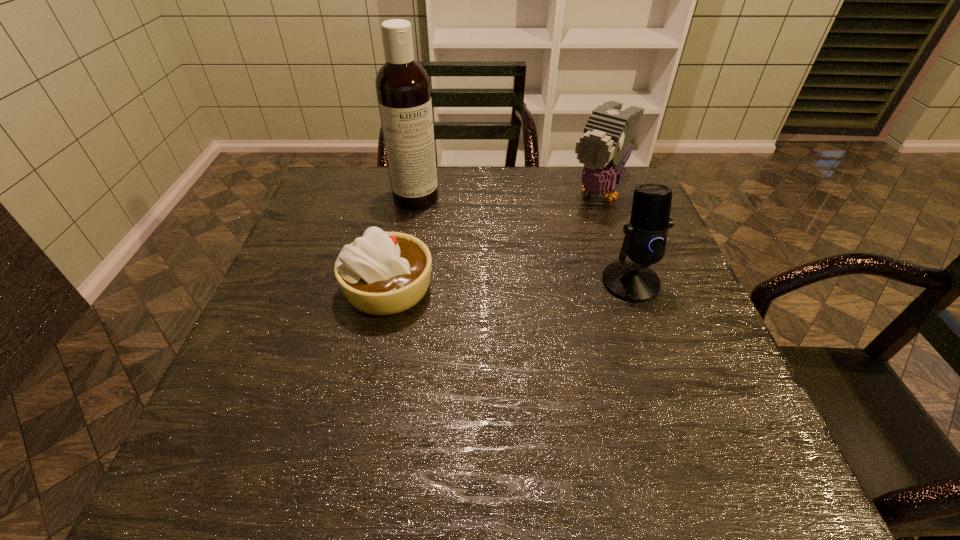
This screenshot has width=960, height=540. What are the coordinates of `vacant space situated on the label side of the tallest object` in the screenshot? It's located at (465, 259).

Locate an element on the screen. This screenshot has width=960, height=540. vacant space located 0.340m on the label side of the tallest object is located at coordinates (484, 285).

What are the coordinates of `bird that is at the far edge` in the screenshot? It's located at (604, 148).

Where is `dishwasher detergent that is at the far edge`? dishwasher detergent that is at the far edge is located at coordinates pyautogui.click(x=402, y=85).

Where is `microphone that is at the right edge`? The image size is (960, 540). microphone that is at the right edge is located at coordinates (645, 239).

Locate an element on the screen. This screenshot has height=540, width=960. bird that is at the right edge is located at coordinates (604, 148).

Locate an element on the screen. The height and width of the screenshot is (540, 960). object present at the far right corner is located at coordinates (604, 148).

This screenshot has width=960, height=540. Identify the location of vacant area at the far edge. (510, 208).

This screenshot has width=960, height=540. I want to click on vacant region at the near edge of the desktop, so click(317, 427).

In the image, there is a desktop. In order to click on vacant space at the left edge in this screenshot , I will do `click(267, 355)`.